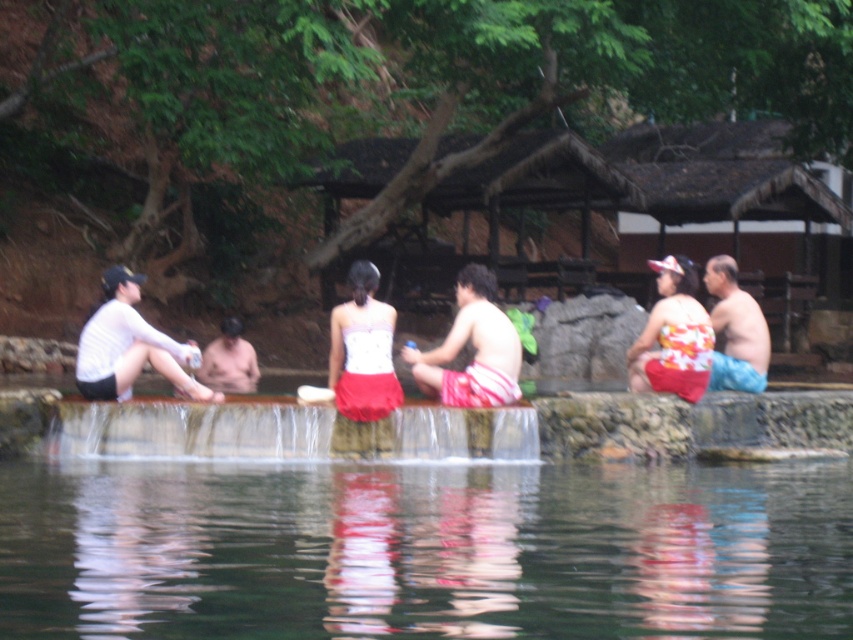
From the picture: Can you confirm if blue fabric shorts at right is wider than smooth skin man at center?

In fact, blue fabric shorts at right might be narrower than smooth skin man at center.

This screenshot has width=853, height=640. What do you see at coordinates (735, 330) in the screenshot?
I see `blue fabric shorts at right` at bounding box center [735, 330].

You are a GUI agent. You are given a task and a screenshot of the screen. Output one action in this format:
    pyautogui.click(x=<x>, y=<y>)
    Task: Click on the blue fabric shorts at right
    The image size is (853, 640).
    Given the screenshot: What is the action you would take?
    pyautogui.click(x=735, y=330)

Which is more to the left, transparent water at center or smooth skin man at center?

From the viewer's perspective, smooth skin man at center appears more on the left side.

Which is below, transparent water at center or smooth skin man at center?

transparent water at center is below.

I want to click on transparent water at center, so [x=424, y=550].

The height and width of the screenshot is (640, 853). What do you see at coordinates (424, 550) in the screenshot? I see `transparent water at center` at bounding box center [424, 550].

Find the location of a particular element. transparent water at center is located at coordinates (424, 550).